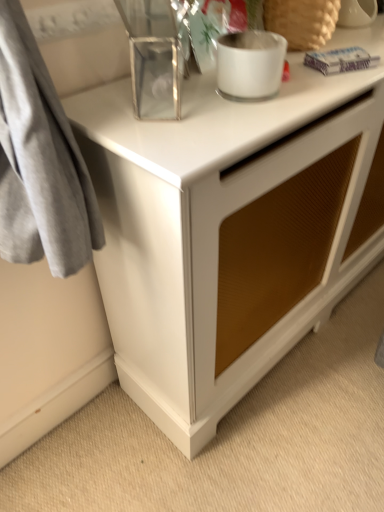
The height and width of the screenshot is (512, 384). Find the location of `free space in front of white ceramic vase at upper right, the third appliance positioned from the left`. free space in front of white ceramic vase at upper right, the third appliance positioned from the left is located at coordinates (351, 38).